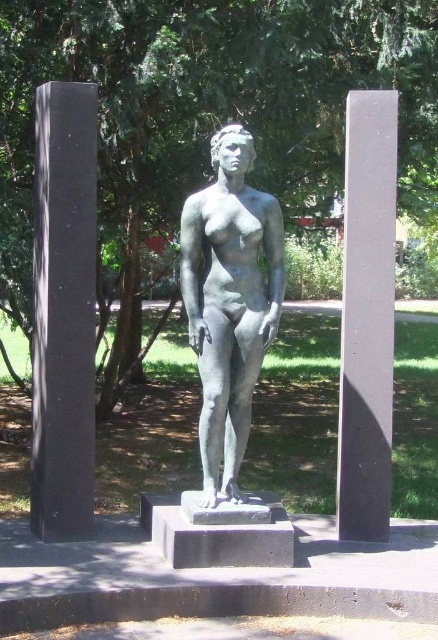
Does black polished stone pillar at left have a larger size compared to polished bronze statue at center?

Yes, black polished stone pillar at left is bigger than polished bronze statue at center.

Does point (81, 173) come farther from viewer compared to point (208, 484)?

Yes.

Is point (84, 524) positioned in front of point (229, 372)?

No, (84, 524) is behind (229, 372).

The width and height of the screenshot is (438, 640). What are the coordinates of `black polished stone pillar at left` in the screenshot? It's located at (63, 310).

Is polished bronze statue at center to the left of smooth gray pillar at right from the viewer's perspective?

Indeed, polished bronze statue at center is positioned on the left side of smooth gray pillar at right.

Measure the distance between point (x=212, y=272) and camera.

They are 4.94 meters apart.

Locate an element on the screen. The width and height of the screenshot is (438, 640). polished bronze statue at center is located at coordinates (229, 300).

Can you confirm if black polished stone pillar at left is bigger than smooth gray pillar at right?

No, black polished stone pillar at left is not bigger than smooth gray pillar at right.

Between black polished stone pillar at left and smooth gray pillar at right, which one has more height?

black polished stone pillar at left is taller.

Describe the element at coordinates (63, 310) in the screenshot. I see `black polished stone pillar at left` at that location.

Locate an element on the screen. black polished stone pillar at left is located at coordinates (63, 310).